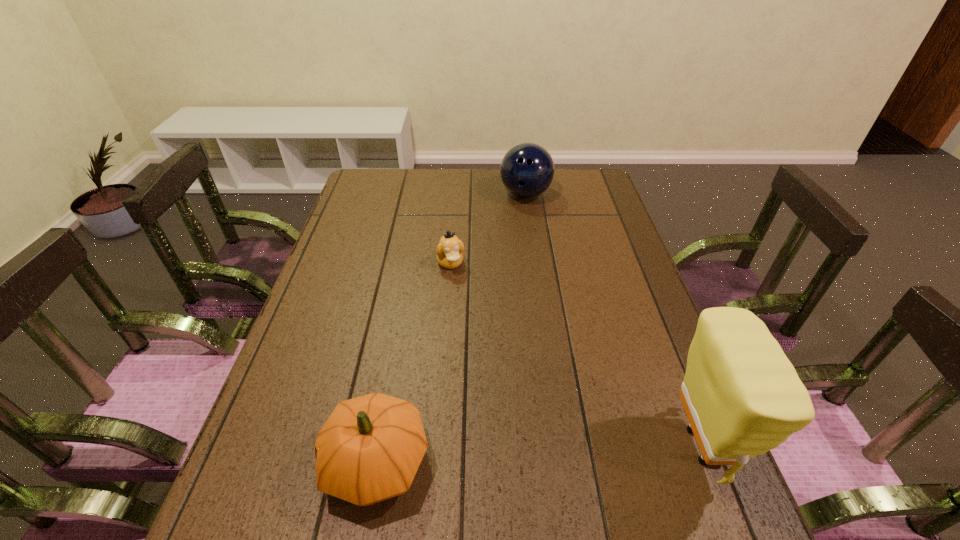
This screenshot has width=960, height=540. What are the coordinates of `vacant space situated on the face of the duckling` in the screenshot? It's located at (470, 317).

Where is `vacant position located 0.070m on the face of the duckling`? This screenshot has width=960, height=540. vacant position located 0.070m on the face of the duckling is located at coordinates (460, 292).

Locate an element on the screen. Image resolution: width=960 pixels, height=540 pixels. vacant space located 0.110m on the face of the duckling is located at coordinates (464, 301).

Identify the location of vacant space located on the surface of the farthest object near the finger holes. The width and height of the screenshot is (960, 540). (537, 247).

Identify the location of blank area located 0.270m on the surface of the farthest object near the finger holes. (539, 258).

Identify the location of free region located 0.340m on the surface of the farthest object near the finger holes. (541, 273).

The width and height of the screenshot is (960, 540). Find the location of `object present at the far edge`. object present at the far edge is located at coordinates (527, 170).

Locate an element on the screen. The width and height of the screenshot is (960, 540). gourd that is at the near edge is located at coordinates pyautogui.click(x=370, y=448).

I want to click on sponge that is at the near edge, so click(742, 396).

Locate an element on the screen. object that is at the left edge is located at coordinates (370, 448).